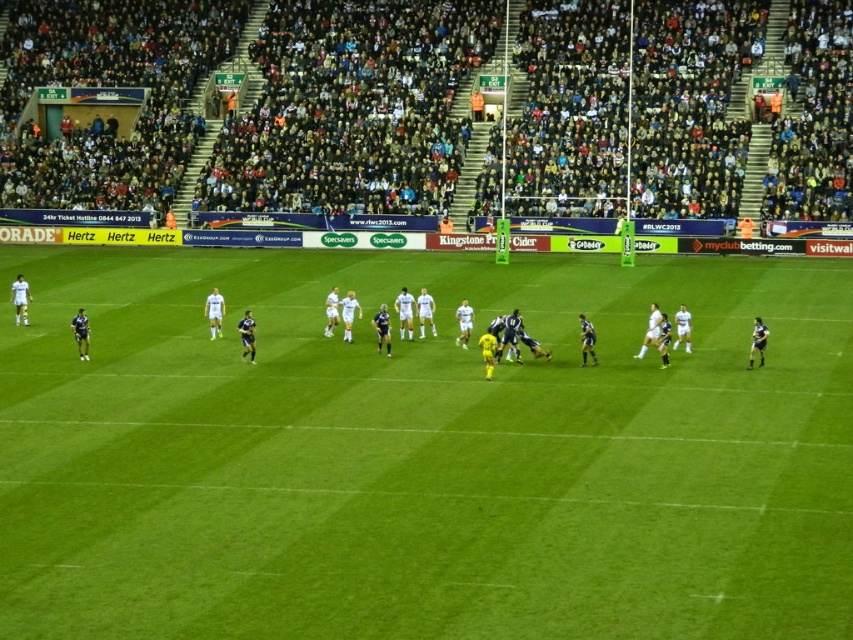
Question: Can you confirm if dark blue jersey at center is positioned to the right of dark gray stadium seats at upper center?

Choices:
 (A) yes
 (B) no

Answer: (A)

Question: Among these points, which one is nearest to the camera?

Choices:
 (A) (332, 385)
 (B) (548, 10)

Answer: (A)

Question: Which point is closer to the camera?

Choices:
 (A) (671, 452)
 (B) (502, 29)

Answer: (A)

Question: Observing the image, what is the correct spatial positioning of green grass field at center in reference to dark blue jersey at center?

Choices:
 (A) above
 (B) below

Answer: (A)

Question: Which object is the farthest from the dark blue jersey at center?

Choices:
 (A) dark gray stadium seats at upper center
 (B) green grass field at center

Answer: (A)

Question: Does green grass field at center come in front of dark gray stadium seats at upper center?

Choices:
 (A) yes
 (B) no

Answer: (A)